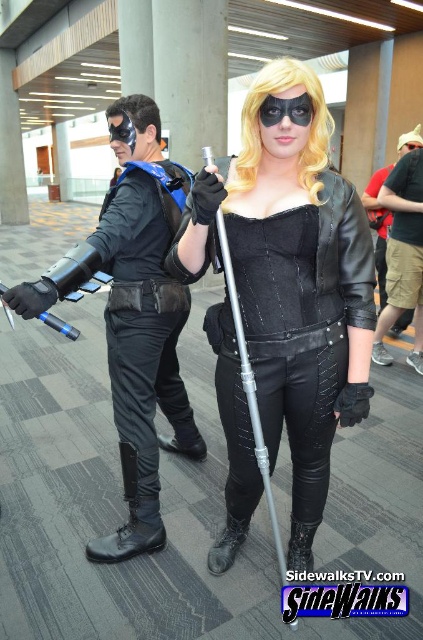
You are a photographer at the event and need to capture a photo that includes both the black leather jacket at center and the matte black armor at left. Based on their positions, which object should you ensure is closer to the camera to include both in the frame?

The black leather jacket at center is in front of the matte black armor at left, so to include both in the frame, ensure the black leather jacket at center is closer to the camera.